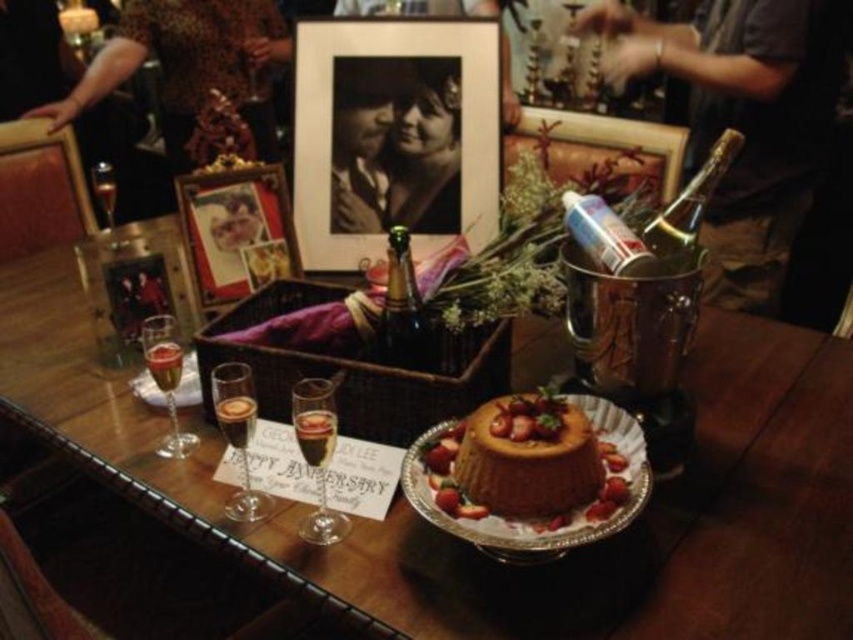
Question: Considering the relative positions of matte black photo frame at upper center and metallic silver can at upper right in the image provided, where is matte black photo frame at upper center located with respect to metallic silver can at upper right?

Choices:
 (A) above
 (B) below

Answer: (A)

Question: Which object is the closest to the metallic silver picture frame at upper center?

Choices:
 (A) translucent glass at lower left
 (B) matte black photo frame at upper center

Answer: (B)

Question: Is matte black photo frame at upper center positioned before clear glass champagne flute at lower center?

Choices:
 (A) no
 (B) yes

Answer: (A)

Question: Can you confirm if metallic silver wine at upper right is positioned to the right of gold metallic picture frame at upper left?

Choices:
 (A) no
 (B) yes

Answer: (B)

Question: Which point is farther to the camera?

Choices:
 (A) metallic silver wine at upper right
 (B) green glass bottle at center
 (C) matte black photo frame at upper center

Answer: (A)

Question: Which point is farther to the camera?

Choices:
 (A) (393, 100)
 (B) (583, 241)

Answer: (A)